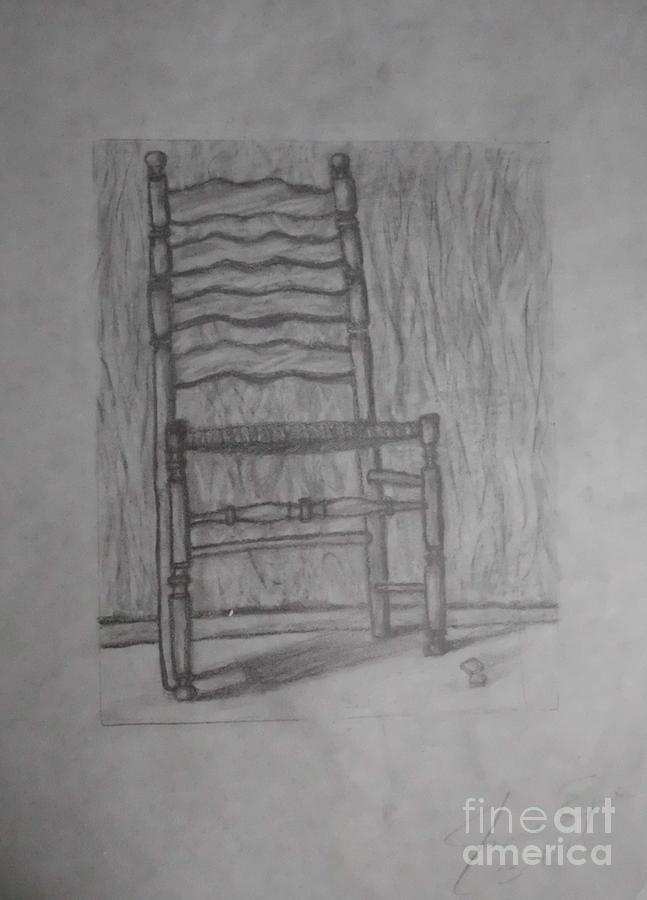
What are the coordinates of `vertical wavy design on wall` in the screenshot? It's located at (487, 247).